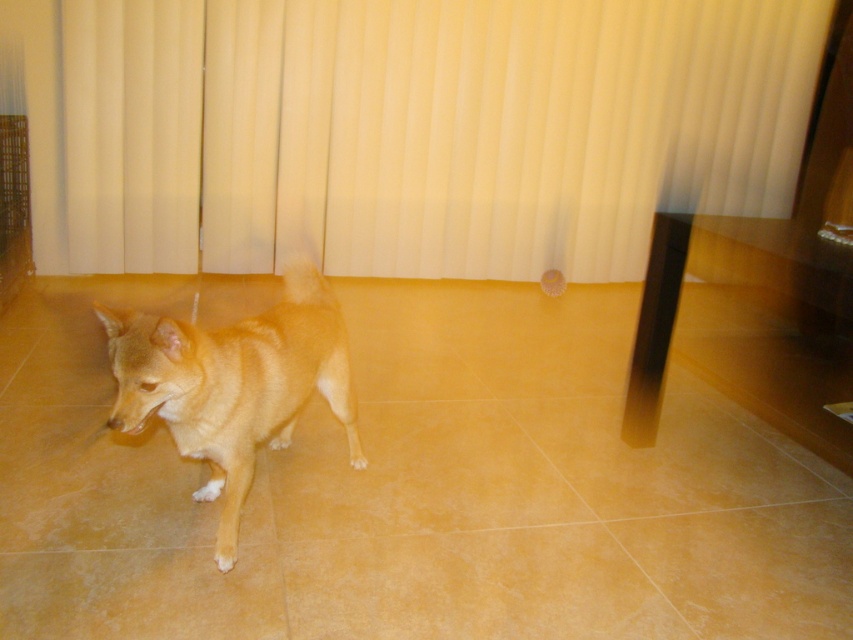
Is point (647, 221) positioned in front of point (320, 312)?

No, (647, 221) is further to viewer.

Who is more distant from viewer, (280, 179) or (306, 324)?

Point (280, 179)

You are a GUI agent. You are given a task and a screenshot of the screen. Output one action in this format:
    pyautogui.click(x=<x>, y=<y>)
    Task: Click on the beige fabric curtain at upper center
    
    Given the screenshot: What is the action you would take?
    pyautogui.click(x=496, y=129)